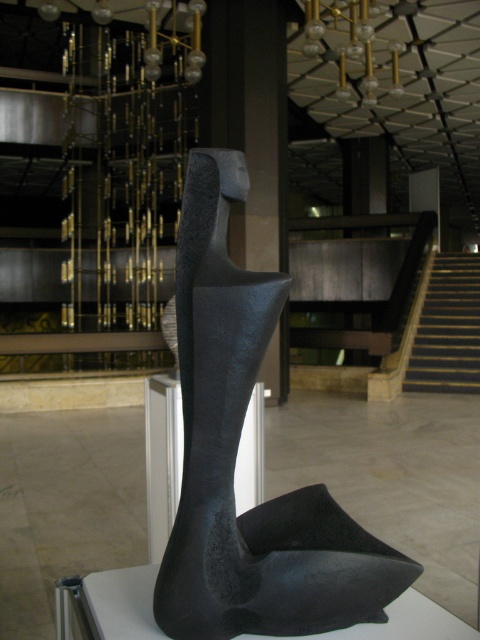
You are an art curator planning to install a new light fixture at position point (236, 456). Based on the scene description, what object is located at this coordinate?

The point (236, 456) marks the location of the matte black sculpture at center.

In the scene shown: You are a photographer standing at the entrance of the gallery. You want to take a closeup shot of the matte black sculpture at center. The camera you are using requires a minimum distance of 32 inches to focus properly. Based on the scene, will you be able to focus on the sculpture from your current position?

The distance between the matte black sculpture at center and the camera is 31.99 inches, which is just below the required 32 inches minimum distance. Therefore, the camera will not be able to focus properly on the sculpture from your current position.

Based on the photo, you are standing in the gallery and want to touch the point at coordinates point (233, 518). Can you reach it without moving your position?

The point (233, 518) is 36.06 inches from the viewer, so yes, you can reach it without moving your position since it is within arm reach.